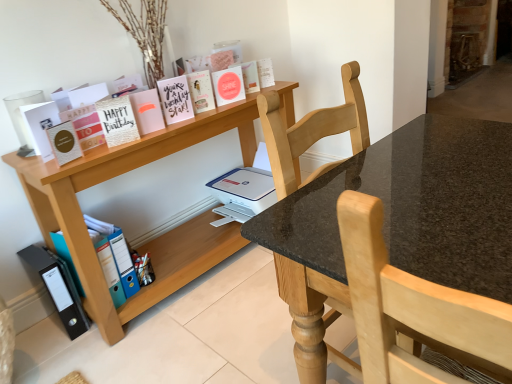
Question: Which direction should I rotate to look at matte pink card at upper center, placed as the seventh paperback book when sorted from left to right?

Choices:
 (A) right
 (B) left

Answer: (B)

Question: Does matte pink paperback book at center, arranged as the 8th paperback book when viewed from the left, have a greater height compared to wooden shelf at upper left?

Choices:
 (A) no
 (B) yes

Answer: (A)

Question: From the image's perspective, is matte pink paperback book at center, which is the third paperback book from right to left, beneath wooden shelf at upper left?

Choices:
 (A) yes
 (B) no

Answer: (B)

Question: Can you confirm if matte pink paperback book at center, arranged as the 8th paperback book when viewed from the left, is shorter than wooden shelf at upper left?

Choices:
 (A) yes
 (B) no

Answer: (A)

Question: Is matte pink paperback book at center, which is the third paperback book from right to left, not within wooden shelf at upper left?

Choices:
 (A) no
 (B) yes

Answer: (B)

Question: Could you tell me if matte pink paperback book at center, which is the third paperback book from right to left, is turned towards wooden shelf at upper left?

Choices:
 (A) yes
 (B) no

Answer: (B)

Question: Can you confirm if matte pink paperback book at center, arranged as the 8th paperback book when viewed from the left, is smaller than wooden shelf at upper left?

Choices:
 (A) yes
 (B) no

Answer: (A)

Question: Does gold textured card at upper left, marked as the second book in a bottom-to-top arrangement, turn towards hardcover book at upper center, the 10th paperback book in the left-to-right sequence?

Choices:
 (A) no
 (B) yes

Answer: (A)

Question: Can hardcover book at upper center, which appears as the 1th paperback book when viewed from the right, be found inside gold textured card at upper left, marked as the second book in a bottom-to-top arrangement?

Choices:
 (A) no
 (B) yes

Answer: (A)

Question: Does gold textured card at upper left, marked as the second book in a bottom-to-top arrangement, come in front of hardcover book at upper center, the 10th paperback book in the left-to-right sequence?

Choices:
 (A) yes
 (B) no

Answer: (A)

Question: Is gold textured card at upper left, which appears as the 1th book when viewed from the top, further to camera compared to hardcover book at upper center, which appears as the 1th paperback book when viewed from the right?

Choices:
 (A) no
 (B) yes

Answer: (A)

Question: From the image's perspective, is gold textured card at upper left, which appears as the 1th book when viewed from the top, located above hardcover book at upper center, which appears as the 1th paperback book when viewed from the right?

Choices:
 (A) yes
 (B) no

Answer: (A)

Question: Can you confirm if gold textured card at upper left, which appears as the 1th book when viewed from the top, is thinner than hardcover book at upper center, the 10th paperback book in the left-to-right sequence?

Choices:
 (A) yes
 (B) no

Answer: (B)

Question: Is gold textured card at upper left, which is the seventh paperback book in right-to-left order, at the back of matte pink card at upper center, the 4th paperback book when ordered from right to left?

Choices:
 (A) yes
 (B) no

Answer: (B)